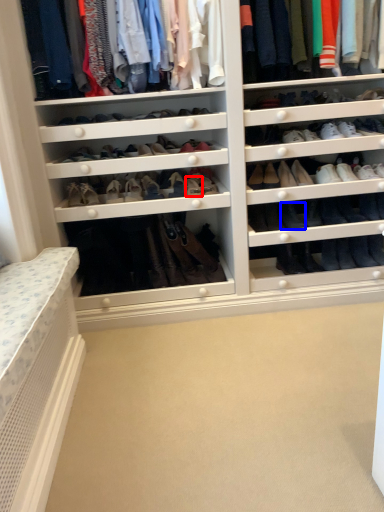
Question: Among these objects, which one is farthest to the camera, shoe (highlighted by a red box) or shoe (highlighted by a blue box)?

Choices:
 (A) shoe
 (B) shoe

Answer: (B)